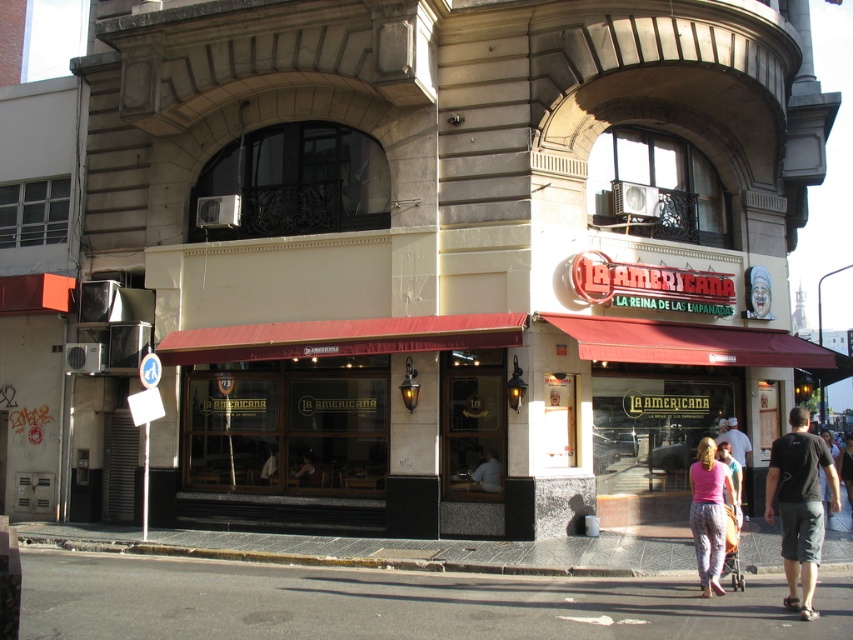
Question: Which point is farther from the camera taking this photo?

Choices:
 (A) (726, 464)
 (B) (158, 618)
 (C) (795, 604)

Answer: (A)

Question: Does black asphalt at lower center appear on the left side of smooth wooden chair at center?

Choices:
 (A) no
 (B) yes

Answer: (A)

Question: Estimate the real-world distances between objects in this image. Which object is closer to the black cotton shirt at lower right?

Choices:
 (A) white fabric shirt at center
 (B) dark blue t-shirt at lower right

Answer: (B)

Question: Is pink fabric pants at lower center below smooth skin person at center?

Choices:
 (A) no
 (B) yes

Answer: (A)

Question: Which of the following is the closest to the observer?

Choices:
 (A) pink fabric pants at lower center
 (B) smooth skin person at center
 (C) black asphalt at lower center

Answer: (C)

Question: Considering the relative positions of black asphalt at lower center and golden fabric dress at center in the image provided, where is black asphalt at lower center located with respect to golden fabric dress at center?

Choices:
 (A) right
 (B) left

Answer: (B)